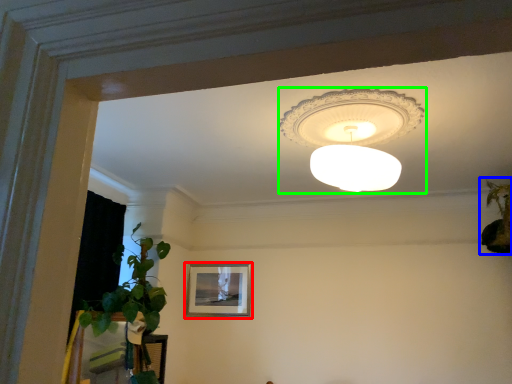
Question: Which object is positioned farthest from picture frame (highlighted by a red box)? Select from houseplant (highlighted by a blue box) and lamp (highlighted by a green box).

Choices:
 (A) houseplant
 (B) lamp

Answer: (A)